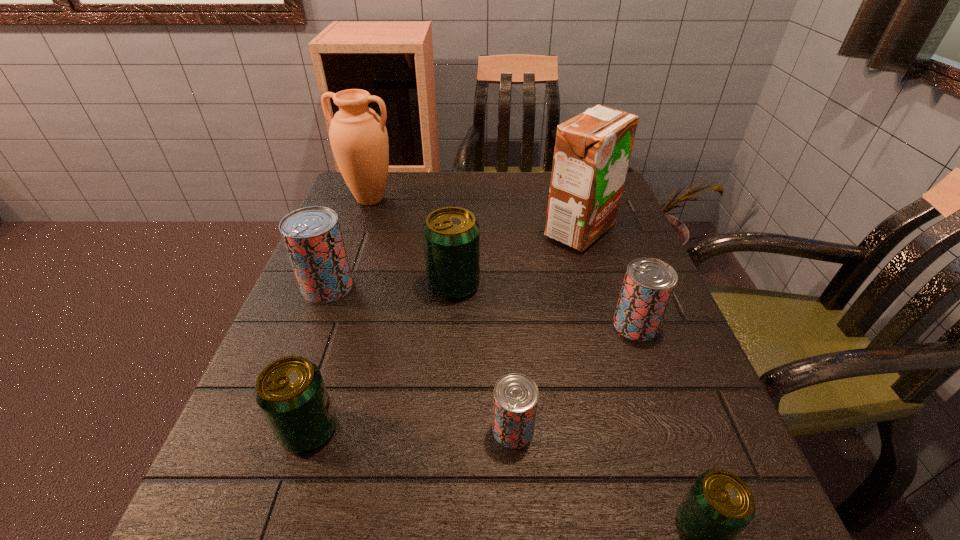
Locate an element on the screen. The height and width of the screenshot is (540, 960). the fourth object from right to left is located at coordinates [515, 400].

Locate an element on the screen. the smallest red beer can is located at coordinates (515, 400).

Where is `free space located on the right of the urn`? Image resolution: width=960 pixels, height=540 pixels. free space located on the right of the urn is located at coordinates (521, 199).

You are a GUI agent. You are given a task and a screenshot of the screen. Output one action in this format:
    pyautogui.click(x=<x>, y=<y>)
    Task: Click on the vacant area situated 0.230m on the straw side of the carton
    This screenshot has height=540, width=960.
    Given the screenshot: What is the action you would take?
    pyautogui.click(x=449, y=231)

The width and height of the screenshot is (960, 540). Identify the location of vacant space situated 0.160m on the straw side of the carton. (477, 231).

You are a GUI agent. You are given a task and a screenshot of the screen. Output one action in this format:
    pyautogui.click(x=<x>, y=<y>)
    Task: Click on the vacant space located 0.240m on the straw side of the carton
    
    Given the screenshot: What is the action you would take?
    444,231

The image size is (960, 540). In order to click on free space located 0.070m on the back of the farthest green beer can in this screenshot , I will do `click(456, 249)`.

Where is `vacant space positioned on the right of the farthest red beer can`? Image resolution: width=960 pixels, height=540 pixels. vacant space positioned on the right of the farthest red beer can is located at coordinates (448, 287).

Locate an element on the screen. This screenshot has width=960, height=540. vacant region located 0.290m on the back of the second biggest red beer can is located at coordinates (600, 227).

The height and width of the screenshot is (540, 960). I want to click on free space located 0.050m on the back of the leftmost green beer can, so click(324, 380).